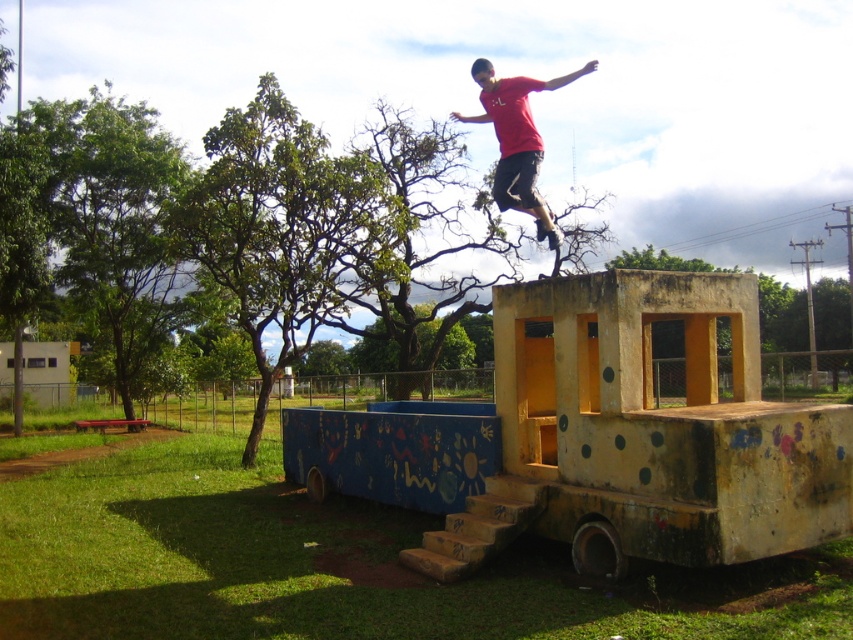
Question: Can you confirm if painted wood obstacle at center is bigger than red matte shirt at upper center?

Choices:
 (A) yes
 (B) no

Answer: (B)

Question: Does painted wood obstacle at center have a greater width compared to red matte shirt at upper center?

Choices:
 (A) no
 (B) yes

Answer: (A)

Question: Is painted wood obstacle at center below red matte shirt at upper center?

Choices:
 (A) no
 (B) yes

Answer: (B)

Question: Which point is farther to the camera?

Choices:
 (A) (523, 371)
 (B) (531, 208)

Answer: (A)

Question: Which point is farther from the camera taking this photo?

Choices:
 (A) (508, 120)
 (B) (694, 525)

Answer: (A)

Question: Which point is farther from the camera taking this photo?

Choices:
 (A) (490, 492)
 (B) (508, 208)

Answer: (B)